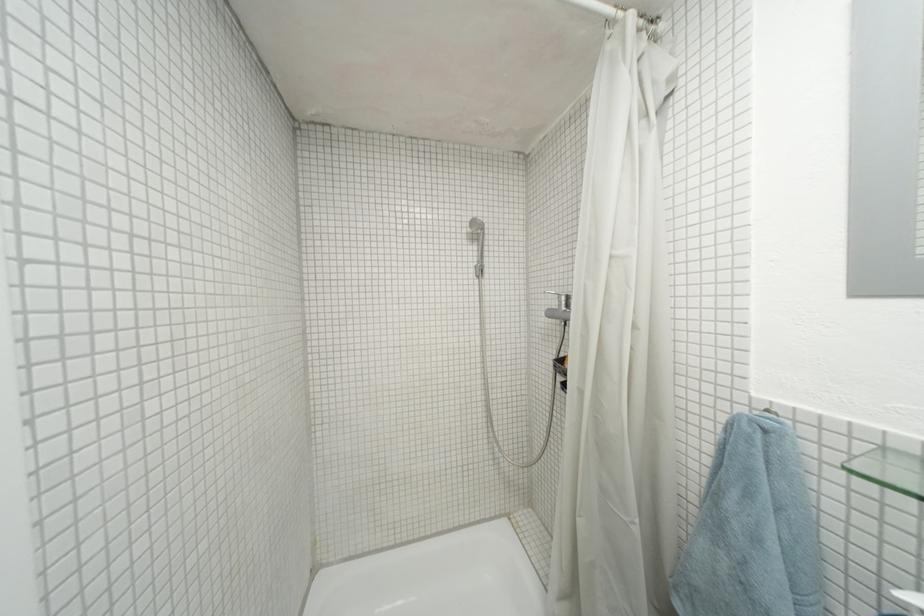
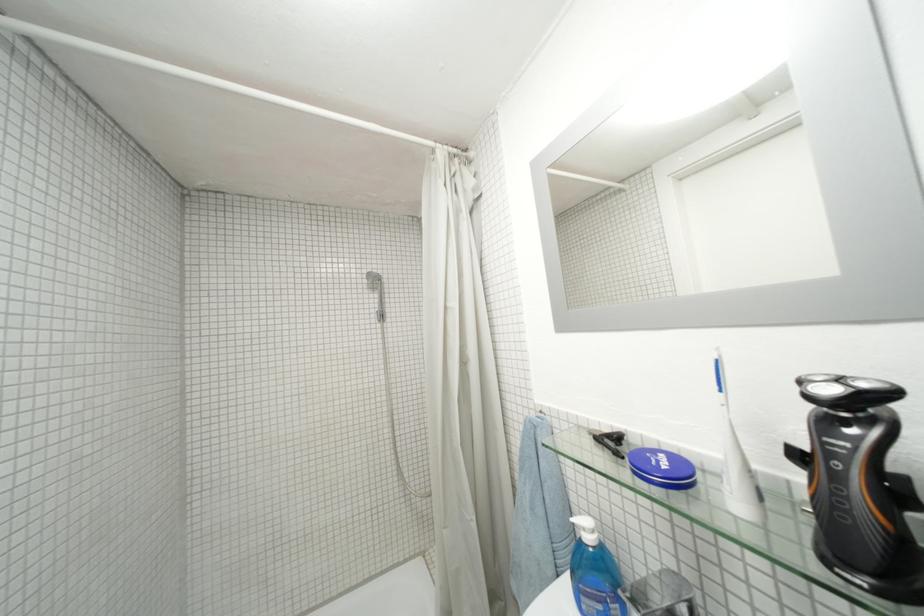
Find the pixel in the second image that matches point 647,523 in the first image.

(482, 521)